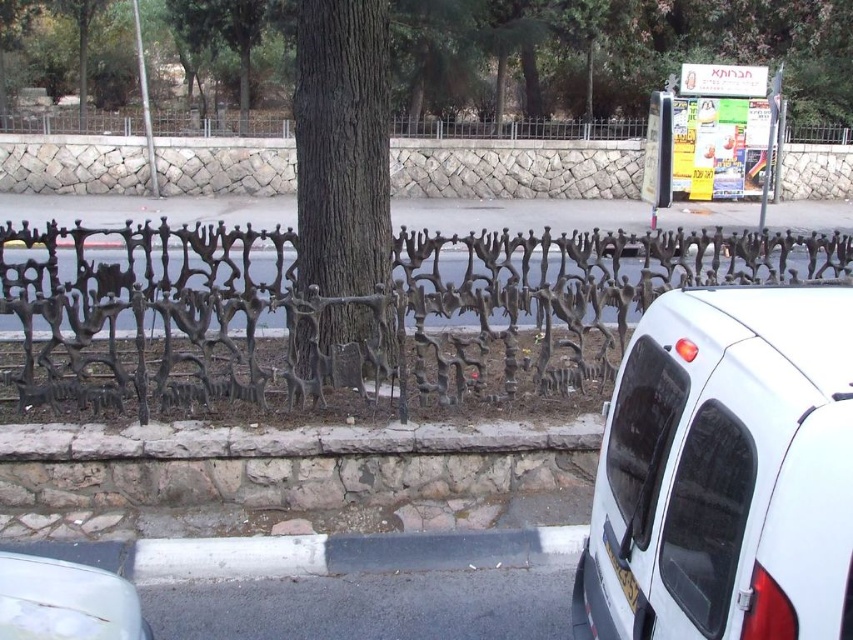
Question: Is brown rough bark tree at center further to the viewer compared to white glossy car at lower left?

Choices:
 (A) no
 (B) yes

Answer: (B)

Question: Does brown textured tree at center appear on the left side of brown rough bark tree at center?

Choices:
 (A) no
 (B) yes

Answer: (B)

Question: Which of the following is the closest to the observer?

Choices:
 (A) white matte minivan at right
 (B) brown rough bark tree at center
 (C) white glossy car at lower left
 (D) black wrought iron fence at center

Answer: (A)

Question: Is white matte minivan at right thinner than black wrought iron fence at center?

Choices:
 (A) yes
 (B) no

Answer: (A)

Question: Which is nearer to the black wrought iron fence at center?

Choices:
 (A) white glossy car at lower left
 (B) brown rough bark tree at center
 (C) brown textured tree at center

Answer: (C)

Question: Which object appears farthest from the camera in this image?

Choices:
 (A) white glossy car at lower left
 (B) brown rough bark tree at center
 (C) white matte minivan at right
 (D) black wrought iron fence at center

Answer: (D)